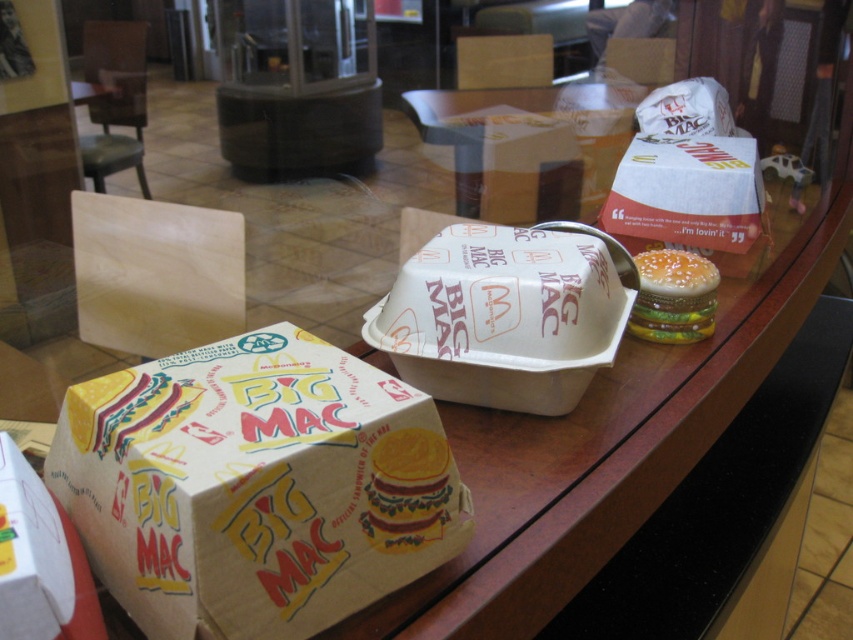
Question: Is yellow paper big mac box at center positioned in front of yellow paper big mac at center?

Choices:
 (A) yes
 (B) no

Answer: (A)

Question: Does yellow paper big mac box at center have a greater width compared to burgundy glossy burger at right?

Choices:
 (A) no
 (B) yes

Answer: (B)

Question: Which of the following is the farthest from the observer?

Choices:
 (A) (396, 544)
 (B) (286, 632)

Answer: (A)

Question: Is yellow paper big mac box at center to the left of burgundy glossy burger at right from the viewer's perspective?

Choices:
 (A) no
 (B) yes

Answer: (B)

Question: Which object is positioned farthest from the yellow paper big mac at center?

Choices:
 (A) burgundy glossy burger at right
 (B) yellow paper big mac box at center

Answer: (A)

Question: Considering the real-world distances, which object is closest to the yellow paper big mac box at center?

Choices:
 (A) burgundy glossy burger at right
 (B) yellow paper big mac at center

Answer: (B)